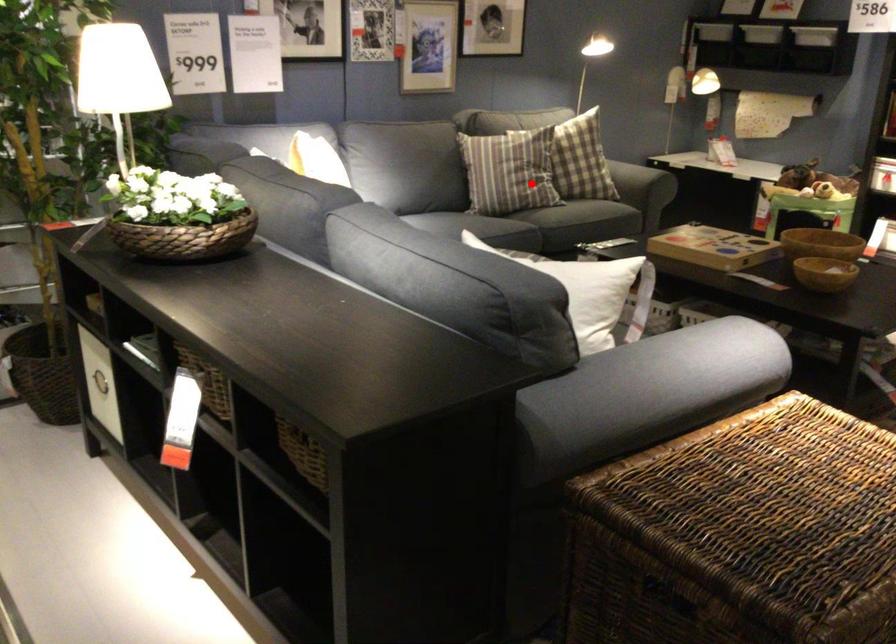
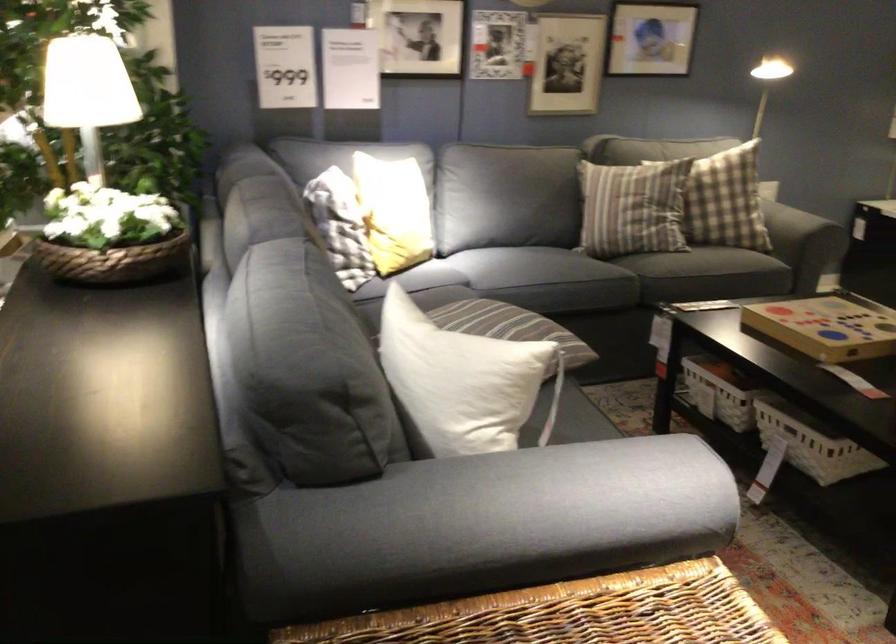
Where in the second image is the point corresponding to the highlighted location from the first image?

(633, 207)